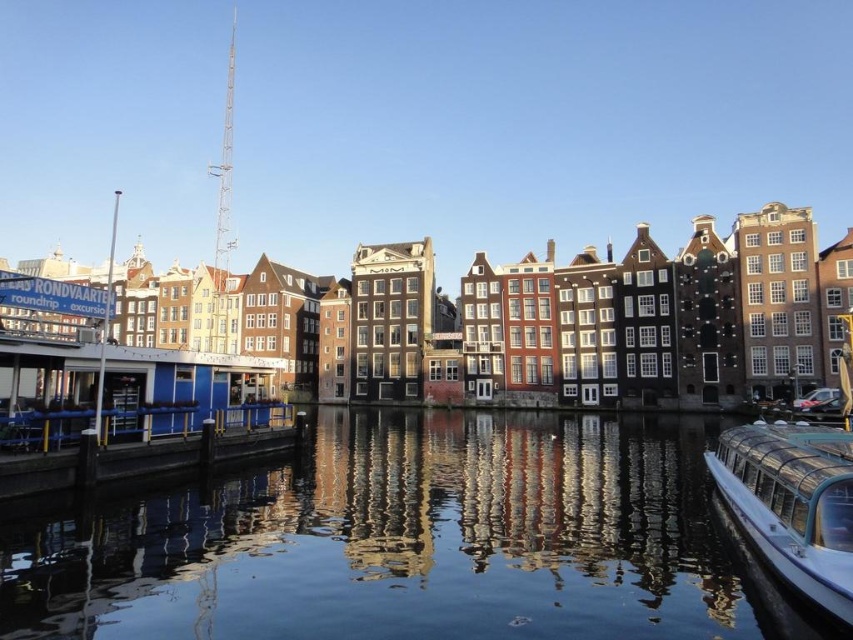
Question: Where is white glossy boat at lower right located in relation to smooth wooden dock at lower left in the image?

Choices:
 (A) below
 (B) above

Answer: (A)

Question: Is white glossy boat at lower right bigger than smooth wooden dock at lower left?

Choices:
 (A) no
 (B) yes

Answer: (A)

Question: Which of these objects is positioned closest to the smooth wooden dock at lower left?

Choices:
 (A) white glossy boat at lower right
 (B) transparent glass water at center

Answer: (B)

Question: Does transparent glass water at center appear over smooth wooden dock at lower left?

Choices:
 (A) no
 (B) yes

Answer: (A)

Question: Considering the real-world distances, which object is closest to the white glossy boat at lower right?

Choices:
 (A) transparent glass water at center
 (B) smooth wooden dock at lower left

Answer: (A)

Question: Which point is closer to the camera?

Choices:
 (A) (379, 566)
 (B) (67, 452)
 (C) (842, 440)

Answer: (A)